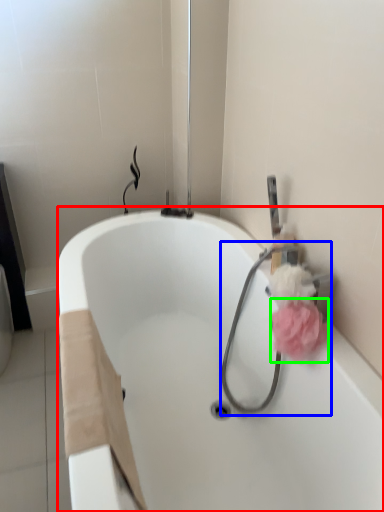
Question: Which object is the farthest from bathtub (highlighted by a red box)? Choose among these: garden hose (highlighted by a blue box) or flower (highlighted by a green box).

Choices:
 (A) garden hose
 (B) flower

Answer: (B)